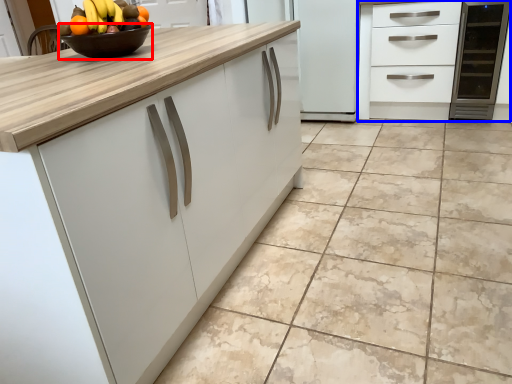
Question: Which of the following is the closest to the observer, bowl (highlighted by a red box) or cabinetry (highlighted by a blue box)?

Choices:
 (A) bowl
 (B) cabinetry

Answer: (A)